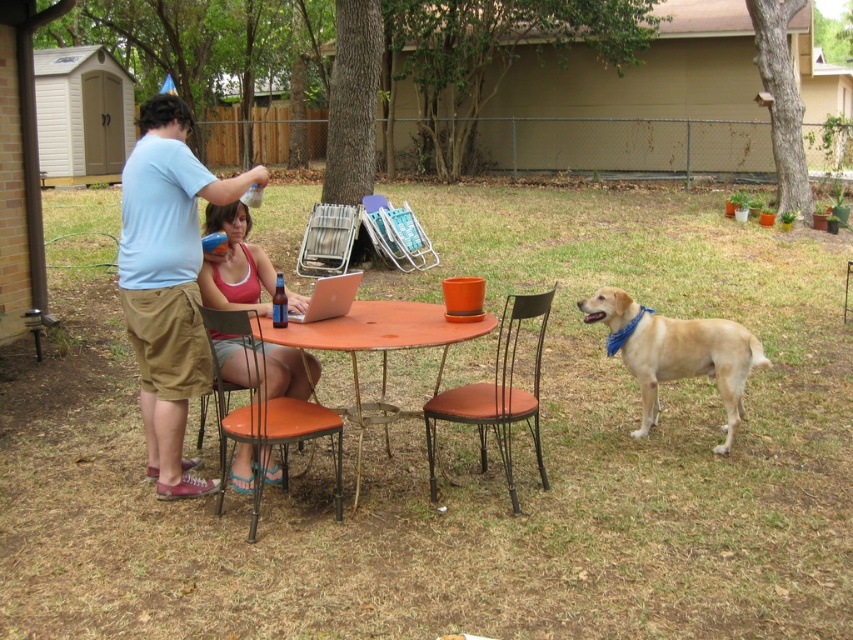
Can you confirm if orange leather chair at lower center is positioned to the right of metallic silver chair at center?

Correct, you'll find orange leather chair at lower center to the right of metallic silver chair at center.

Based on the photo, which of these two, orange leather chair at lower center or metallic silver chair at center, stands shorter?

metallic silver chair at center

Which is in front, point (257, 356) or point (294, 262)?

Point (257, 356)

Find the location of a particular element. The width and height of the screenshot is (853, 640). orange leather chair at lower center is located at coordinates (265, 412).

Consider the image. Is light blue t-shirt at left bigger than matte orange chair at center?

Indeed, light blue t-shirt at left has a larger size compared to matte orange chair at center.

Where is `light blue t-shirt at left`? The width and height of the screenshot is (853, 640). light blue t-shirt at left is located at coordinates (167, 282).

The height and width of the screenshot is (640, 853). In order to click on light blue t-shirt at left in this screenshot , I will do `click(167, 282)`.

Locate an element on the screen. This screenshot has width=853, height=640. light blue t-shirt at left is located at coordinates (167, 282).

Consider the image. Is orange matte table at center to the right of metallic orange chair at center from the viewer's perspective?

Incorrect, orange matte table at center is not on the right side of metallic orange chair at center.

Consider the image. Who is positioned more to the right, orange matte table at center or metallic orange chair at center?

From the viewer's perspective, metallic orange chair at center appears more on the right side.

Between point (465, 323) and point (531, 403), which one is positioned in front?

Point (465, 323) is more forward.

The height and width of the screenshot is (640, 853). I want to click on orange matte table at center, so click(376, 349).